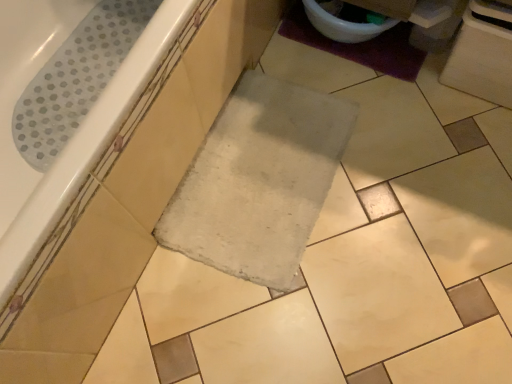
This screenshot has height=384, width=512. Find the location of `free spot above white glossy toilet bowl at upper right (from a real-world perspective)`. free spot above white glossy toilet bowl at upper right (from a real-world perspective) is located at coordinates (352, 6).